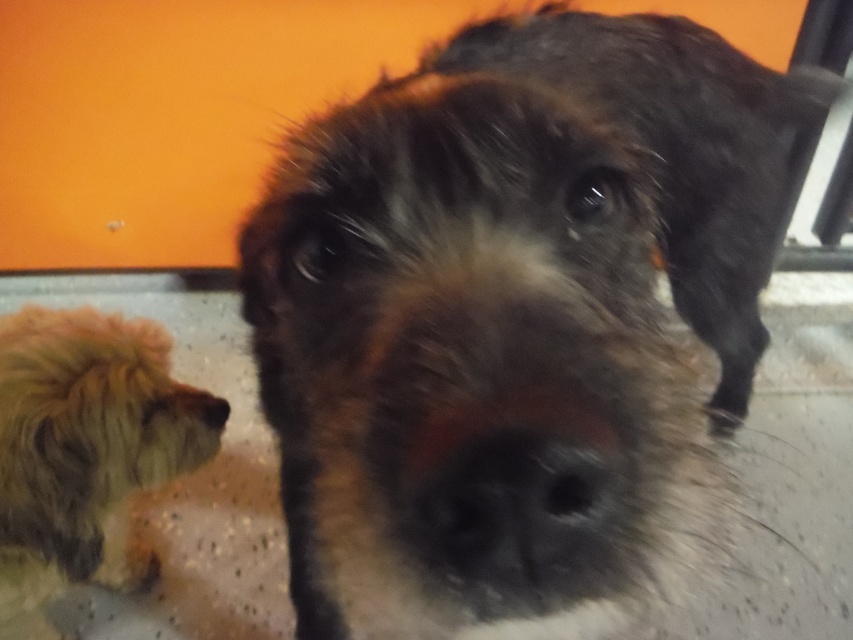
You are standing in front of the two dogs in the image. There are two points marked on the image. One is at point (x=25, y=378) and the other at point (x=225, y=410). Which point is closer to you?

Point (x=25, y=378) is in front of point (x=225, y=410), so it is closer to you.

You are standing in front of the two dogs in the scene. There are two points marked in the image. The first point is at coordinates point (412, 548) and the second point is at point (219, 426). Which point is closer to you?

Point (412, 548) is in front of point (219, 426), so it is closer to you.

You are a dog groomer who needs to choose the right size of grooming table for the dogs in the image. The brown fuzzy dog at center and the fuzzy brown dog at lower left are both present. Which dog requires a larger grooming table based on their size?

The brown fuzzy dog at center requires a larger grooming table because its width is larger than the fuzzy brown dog at lower left.